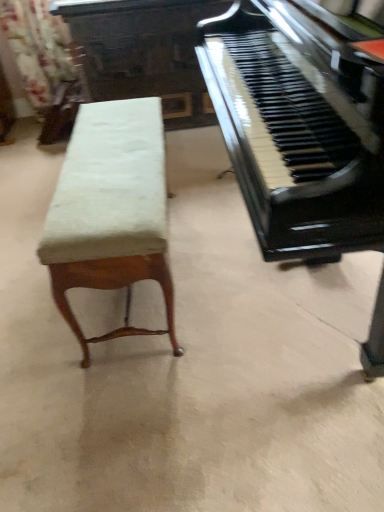
The width and height of the screenshot is (384, 512). Find the location of `free space in front of velvet upholstered bench at left`. free space in front of velvet upholstered bench at left is located at coordinates (159, 400).